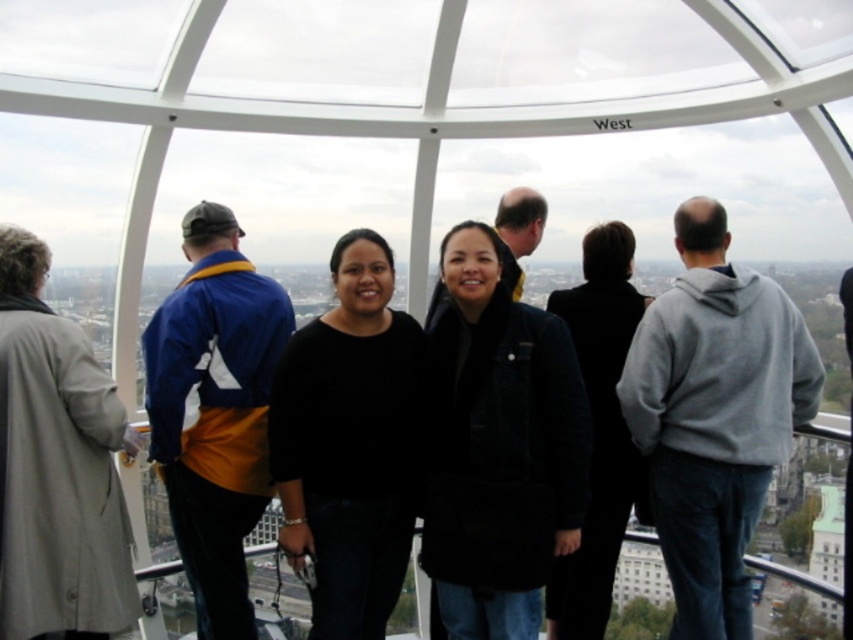
Does black denim jacket at center lie in front of black wool coat at center?

Yes, black denim jacket at center is in front of black wool coat at center.

Who is taller, black denim jacket at center or black wool coat at center?

With more height is black wool coat at center.

Who is more distant from viewer, (x=494, y=618) or (x=618, y=531)?

The point (x=618, y=531) is more distant.

Where is `black denim jacket at center`? This screenshot has height=640, width=853. black denim jacket at center is located at coordinates (498, 445).

Can you confirm if black matte sweater at center is thinner than black wool coat at center?

In fact, black matte sweater at center might be wider than black wool coat at center.

Which is more to the left, black matte sweater at center or black wool coat at center?

black matte sweater at center

Is point (398, 374) positioned after point (585, 253)?

No, it is in front of (585, 253).

Where is `black matte sweater at center`? This screenshot has width=853, height=640. black matte sweater at center is located at coordinates (350, 444).

Looking at this image, does black denim jacket at center have a larger size compared to black matte sweater at center?

Indeed, black denim jacket at center has a larger size compared to black matte sweater at center.

How distant is black denim jacket at center from black matte sweater at center?

black denim jacket at center and black matte sweater at center are 25.50 meters apart.

Does point (514, 422) come farther from viewer compared to point (271, 390)?

No, it is not.

Find the location of a particular element. This screenshot has height=640, width=853. black denim jacket at center is located at coordinates (498, 445).